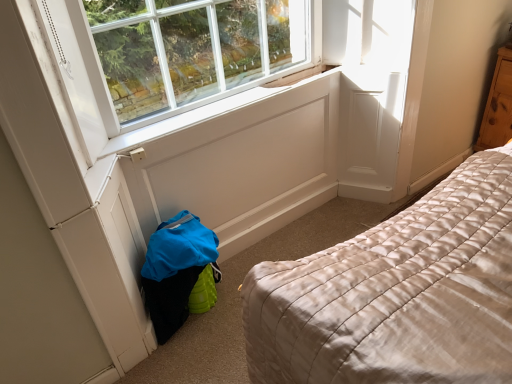
Question: Which is correct: wooden dresser at right is inside white painted wood at center, or outside of it?

Choices:
 (A) inside
 (B) outside

Answer: (B)

Question: Is point (505, 112) positioned closer to the camera than point (138, 132)?

Choices:
 (A) farther
 (B) closer

Answer: (A)

Question: Based on their sizes in the image, would you say wooden dresser at right is bigger or smaller than white painted wood at center?

Choices:
 (A) small
 (B) big

Answer: (B)

Question: Is white painted wood at center to the left or to the right of wooden dresser at right in the image?

Choices:
 (A) right
 (B) left

Answer: (B)

Question: Looking at the image, does white painted wood at center seem bigger or smaller compared to wooden dresser at right?

Choices:
 (A) big
 (B) small

Answer: (B)

Question: From the image's perspective, is white painted wood at center located above or below wooden dresser at right?

Choices:
 (A) below
 (B) above

Answer: (A)

Question: In terms of width, does white painted wood at center look wider or thinner when compared to wooden dresser at right?

Choices:
 (A) thin
 (B) wide

Answer: (A)